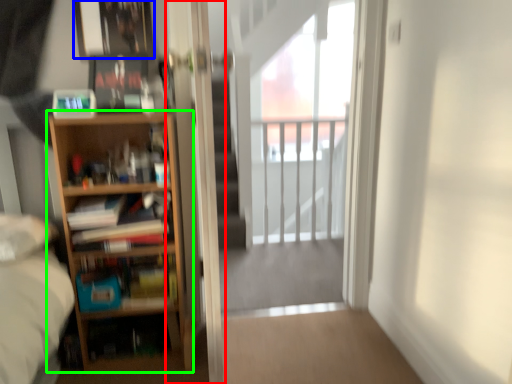
Question: Based on their relative distances, which object is nearer to screen door (highlighted by a red box)? Choose from picture frame (highlighted by a blue box) and bookcase (highlighted by a green box).

Choices:
 (A) picture frame
 (B) bookcase

Answer: (B)